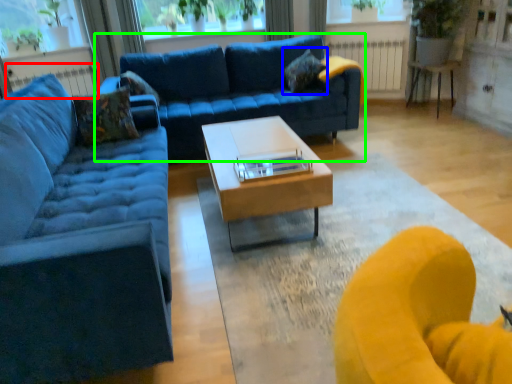
Question: Which object is the farthest from radiator (highlighted by a red box)? Choose among these: pillow (highlighted by a blue box) or studio couch (highlighted by a green box).

Choices:
 (A) pillow
 (B) studio couch

Answer: (A)